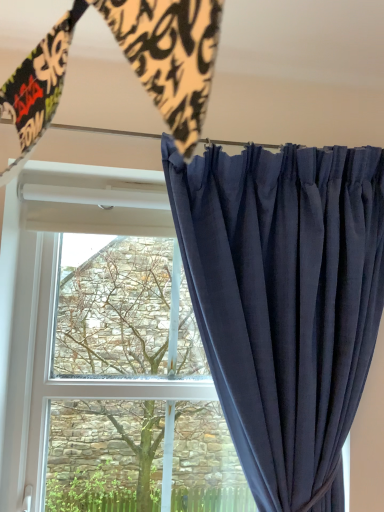
Question: Relative to navy blue velvet curtain at right, is green leafy tree at center in front or behind?

Choices:
 (A) front
 (B) behind

Answer: (B)

Question: In terms of size, does green leafy tree at center appear bigger or smaller than navy blue velvet curtain at right?

Choices:
 (A) big
 (B) small

Answer: (B)

Question: Do you think green leafy tree at center is within navy blue velvet curtain at right, or outside of it?

Choices:
 (A) inside
 (B) outside

Answer: (B)

Question: In terms of size, does navy blue velvet curtain at right appear bigger or smaller than green leafy tree at center?

Choices:
 (A) big
 (B) small

Answer: (A)

Question: Visually, is navy blue velvet curtain at right positioned to the left or to the right of green leafy tree at center?

Choices:
 (A) right
 (B) left

Answer: (A)

Question: Is navy blue velvet curtain at right wider or thinner than green leafy tree at center?

Choices:
 (A) wide
 (B) thin

Answer: (A)

Question: Would you say navy blue velvet curtain at right is inside or outside green leafy tree at center?

Choices:
 (A) outside
 (B) inside

Answer: (A)